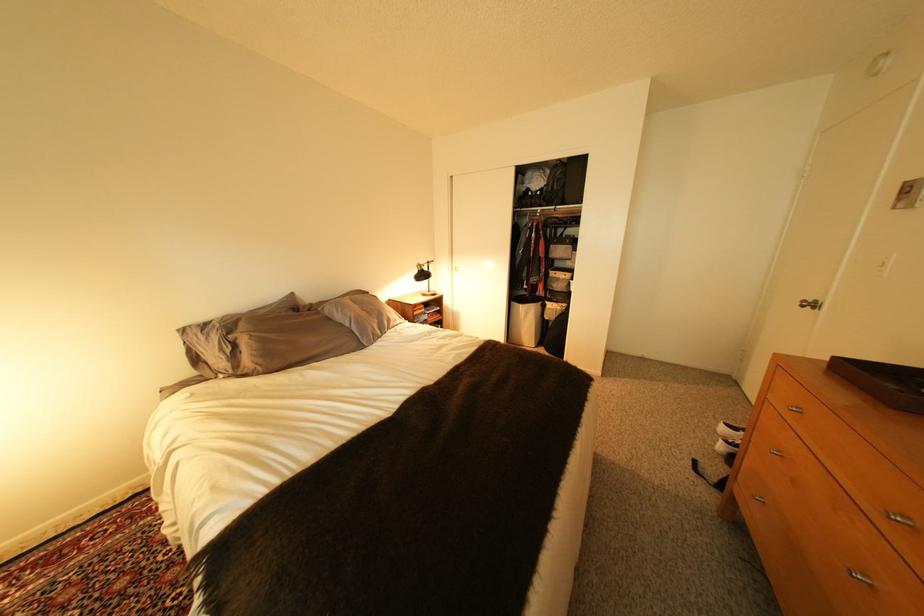
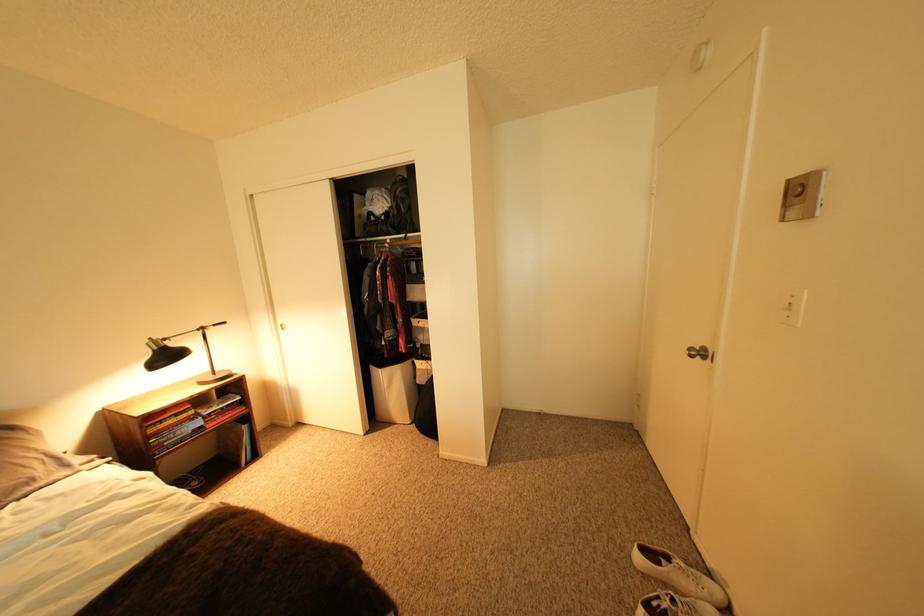
The images are taken continuously from a first-person perspective. In which direction are you moving?

The cameraman walked toward right, forward.